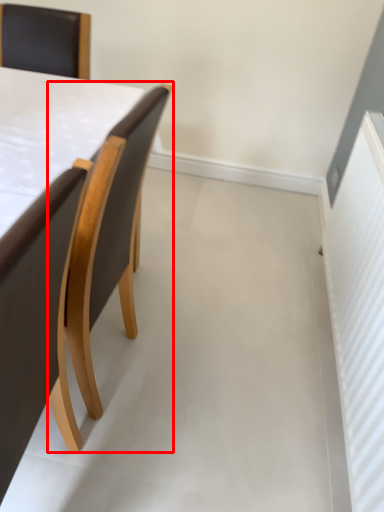
Question: From the image's perspective, what is the correct spatial positioning of chair (annotated by the red box) in reference to chair?

Choices:
 (A) below
 (B) above

Answer: (B)